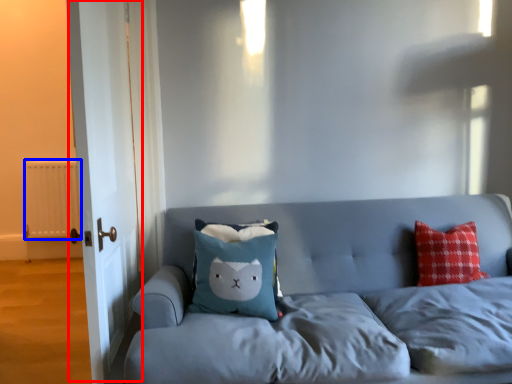
Question: Which point is closer to the camera, door (highlighted by a red box) or radiator (highlighted by a blue box)?

Choices:
 (A) door
 (B) radiator

Answer: (A)